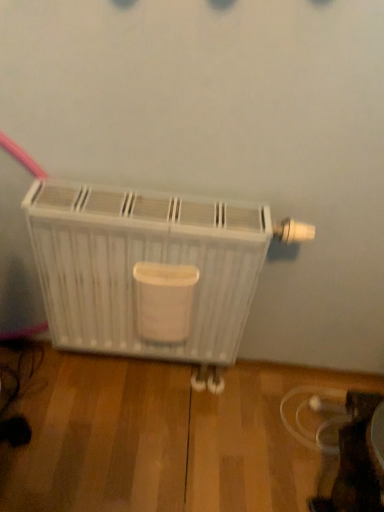
Locate an element on the screen. vacant area in front of white plastic radiator at center is located at coordinates (137, 463).